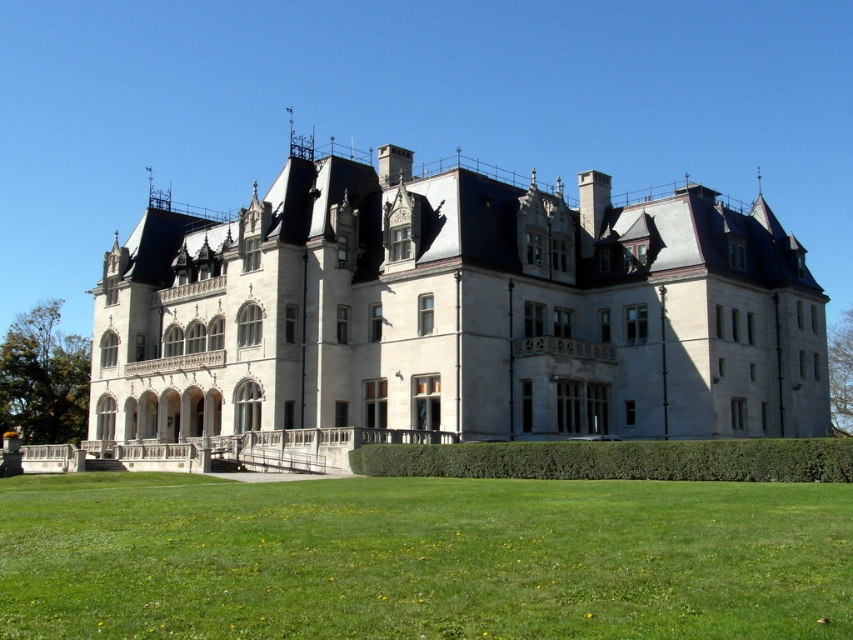
Is green grass at lower center bigger than green leafy hedge at lower center?

Yes, green grass at lower center is bigger than green leafy hedge at lower center.

Is green grass at lower center shorter than green leafy hedge at lower center?

In fact, green grass at lower center may be taller than green leafy hedge at lower center.

Locate an element on the screen. The height and width of the screenshot is (640, 853). green grass at lower center is located at coordinates (x=421, y=557).

Is stone mansion at center behind green grass at lower center?

Yes.

The image size is (853, 640). Describe the element at coordinates (453, 314) in the screenshot. I see `stone mansion at center` at that location.

The height and width of the screenshot is (640, 853). What are the coordinates of `stone mansion at center` in the screenshot? It's located at point(453,314).

Is stone mansion at center wider than green leafy hedge at lower center?

Yes, stone mansion at center is wider than green leafy hedge at lower center.

Which is below, stone mansion at center or green leafy hedge at lower center?

green leafy hedge at lower center

Is point (183, 230) positioned after point (407, 468)?

Yes, it is behind point (407, 468).

Find the location of a particular element. This screenshot has height=640, width=853. stone mansion at center is located at coordinates (453, 314).